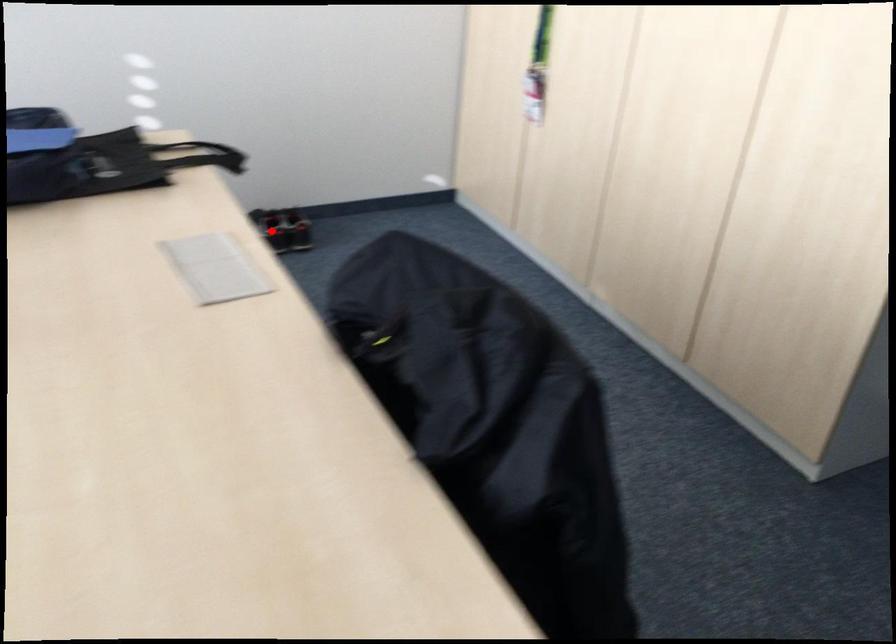
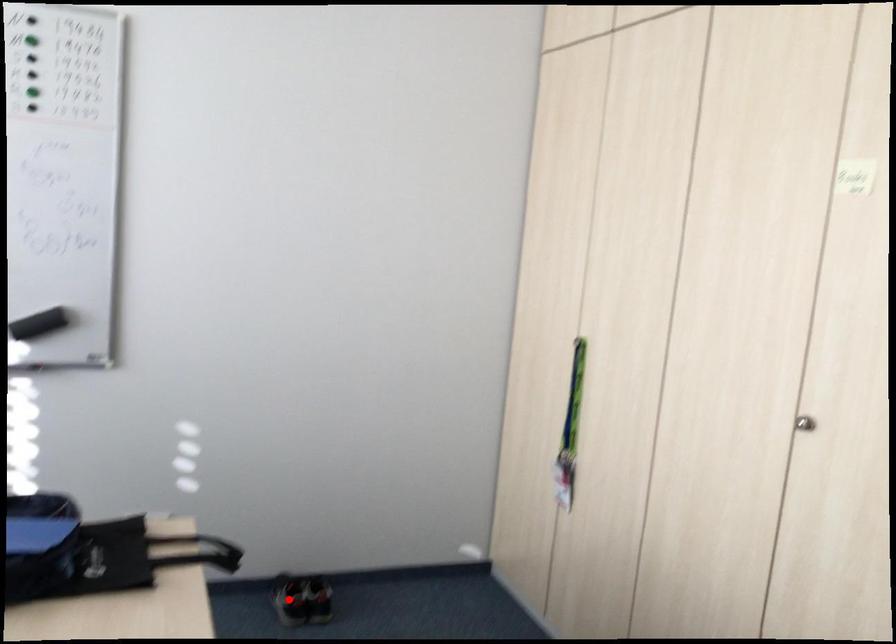
I am providing you with two images of the same scene from different viewpoints. A red point is marked on the first image and another point is marked on the second image. Are the points marked in image1 and image2 representing the same 3D position?

Yes